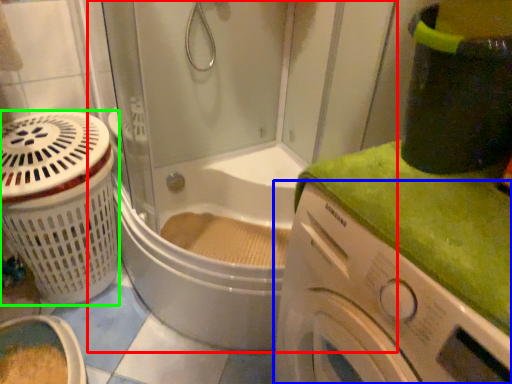
Question: Considering the real-world distances, which object is farthest from shower door (highlighted by a red box)? washing machine (highlighted by a blue box) or basket (highlighted by a green box)?

Choices:
 (A) washing machine
 (B) basket

Answer: (A)